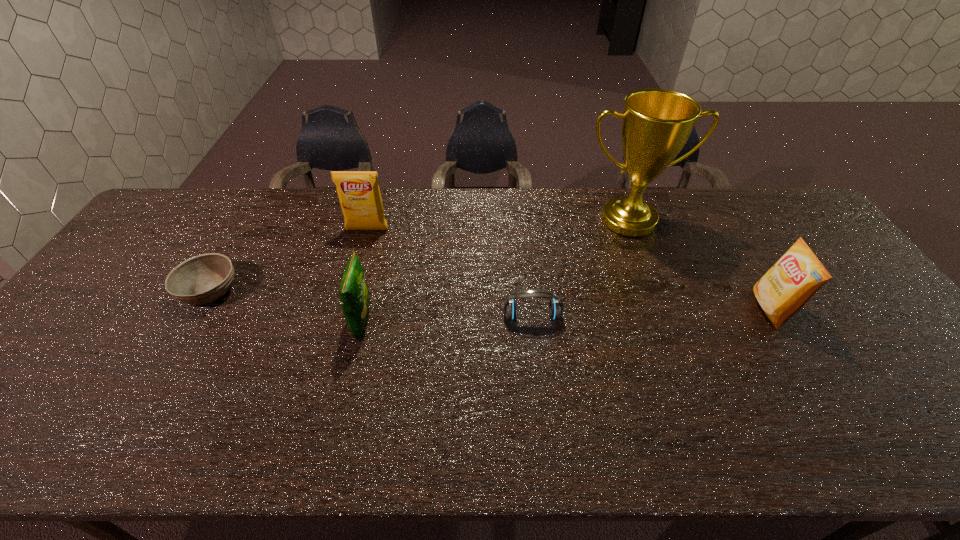
Locate an element on the screen. The image size is (960, 540). object that stands as the fourth closest to the farthest crisp (potato chip) is located at coordinates (656, 123).

The height and width of the screenshot is (540, 960). I want to click on object that is the closest to the third object from right to left, so click(x=656, y=123).

Select which crisp (potato chip) is the second closest to the shortest object. Please provide its 2D coordinates. Your answer should be formatted as a tuple, i.e. [(x, y)], where the tuple contains the x and y coordinates of a point satisfying the conditions above.

[(354, 296)]

Identify which crisp (potato chip) is located as the second nearest to the farthest crisp (potato chip). Please provide its 2D coordinates. Your answer should be formatted as a tuple, i.e. [(x, y)], where the tuple contains the x and y coordinates of a point satisfying the conditions above.

[(790, 283)]

This screenshot has width=960, height=540. What are the coordinates of `free space that satisfies the following two spatial constraints: 1. on the front-facing side of the rightmost object; 2. on the ear cups of the headset` in the screenshot? It's located at (774, 316).